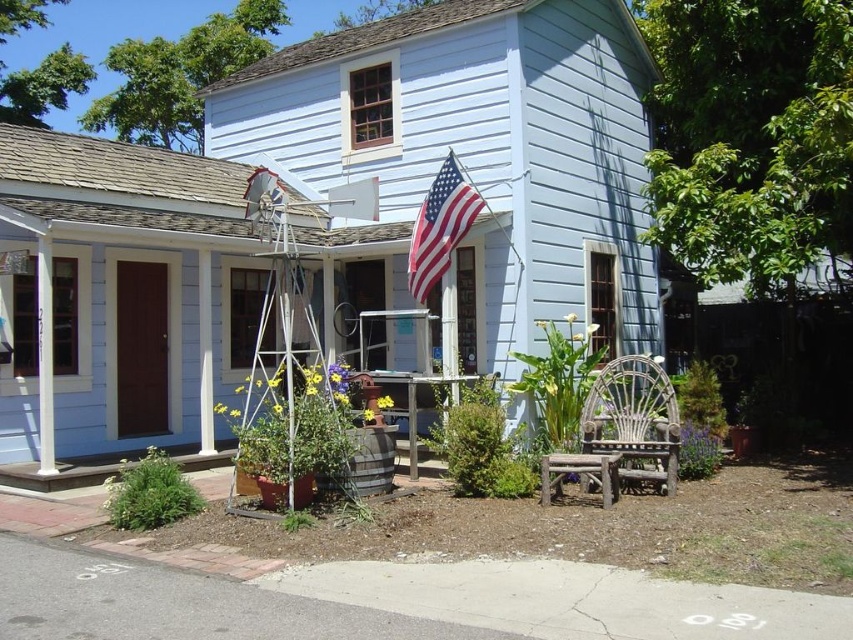
Can you confirm if white wicker chair at lower right is taller than white painted wood at center?

No.

In the scene shown: Which of these two, white wicker chair at lower right or white painted wood at center, stands taller?

white painted wood at center is taller.

The width and height of the screenshot is (853, 640). I want to click on white wicker chair at lower right, so click(634, 420).

Where is `white wicker chair at lower right`? The width and height of the screenshot is (853, 640). white wicker chair at lower right is located at coordinates (634, 420).

Does white painted wood at center have a greater height compared to rustic wood stool at lower center?

Indeed, white painted wood at center has a greater height compared to rustic wood stool at lower center.

The image size is (853, 640). I want to click on white painted wood at center, so click(206, 353).

The image size is (853, 640). I want to click on white painted wood at center, so click(206, 353).

Who is more distant from viewer, (457, 221) or (601, 460)?

The point (457, 221) is more distant.

Is american flag at upper center wider than rustic wood stool at lower center?

Indeed, american flag at upper center has a greater width compared to rustic wood stool at lower center.

Between point (424, 228) and point (614, 476), which one is positioned behind?

The point (424, 228) is behind.

Where is `american flag at upper center`? american flag at upper center is located at coordinates (440, 227).